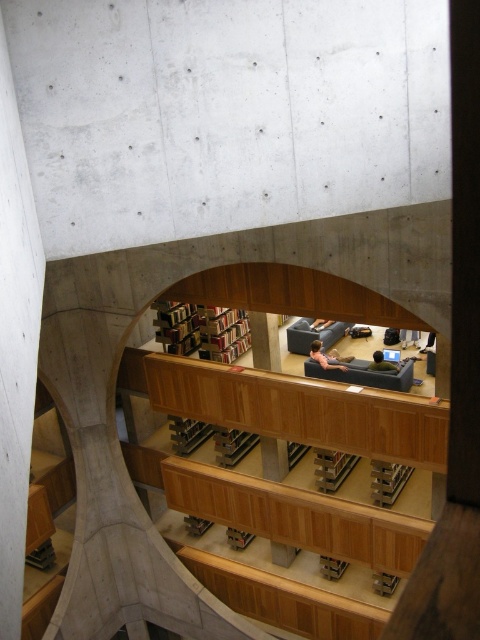
The height and width of the screenshot is (640, 480). What do you see at coordinates (15, 340) in the screenshot? I see `white concrete pillar at center` at bounding box center [15, 340].

Between white concrete pillar at center and wooden bookshelf at center, which one is positioned lower?

Positioned lower is wooden bookshelf at center.

Where is `white concrete pillar at center`? This screenshot has height=640, width=480. white concrete pillar at center is located at coordinates (15, 340).

Is point (232, 564) farther from camera compared to point (223, 340)?

That is True.

Is wooden stairs at center smaller than wooden bookshelf at center?

Indeed, wooden stairs at center has a smaller size compared to wooden bookshelf at center.

Which is behind, point (363, 634) or point (218, 316)?

Positioned behind is point (218, 316).

In order to click on wooden stairs at center in this screenshot , I will do `click(285, 538)`.

Does wooden stairs at center come in front of white concrete pillar at center?

No, it is behind white concrete pillar at center.

Who is lower down, wooden stairs at center or white concrete pillar at center?

wooden stairs at center is lower down.

Which is in front, point (227, 516) or point (28, 346)?

Point (28, 346) is more forward.

Find the location of a particular element. This screenshot has width=480, height=640. wooden stairs at center is located at coordinates (285, 538).